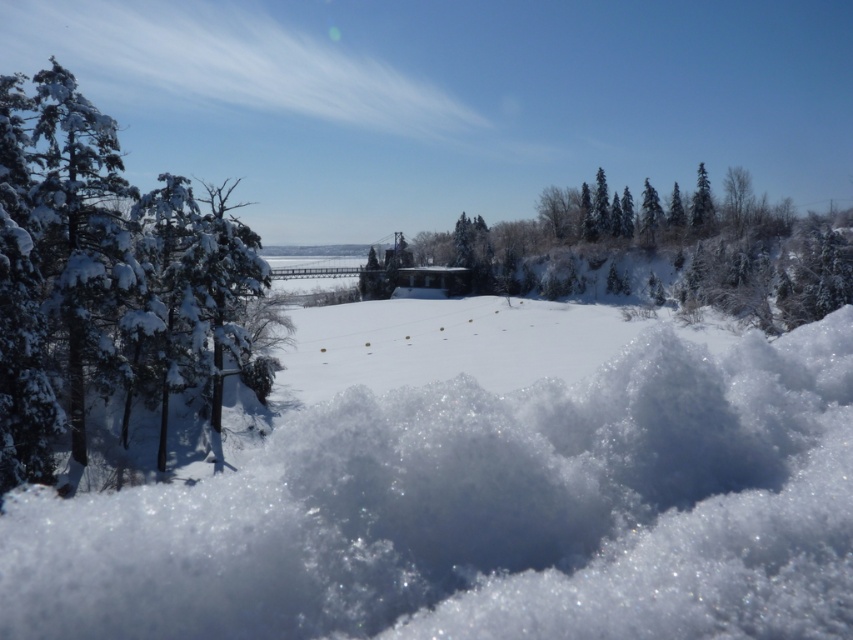
Question: Is snow-covered evergreen at left positioned behind green matte evergreen tree at upper right?

Choices:
 (A) no
 (B) yes

Answer: (A)

Question: Which of these objects is positioned closest to the green matte evergreen tree at upper right?

Choices:
 (A) snow-covered evergreen at left
 (B) green snow-covered trees at center
 (C) white fluffy snow at center

Answer: (B)

Question: Is green snow-covered trees at center positioned at the back of green matte evergreen tree at upper right?

Choices:
 (A) no
 (B) yes

Answer: (A)

Question: Among these objects, which one is nearest to the camera?

Choices:
 (A) green matte evergreen tree at upper right
 (B) green snow-covered trees at center
 (C) snow-covered evergreen at left
 (D) white fluffy snow at center

Answer: (D)

Question: Does white fluffy snow at center have a smaller size compared to snow-covered evergreen at left?

Choices:
 (A) no
 (B) yes

Answer: (B)

Question: Based on their relative distances, which object is farther from the white fluffy snow at center?

Choices:
 (A) green matte evergreen tree at upper right
 (B) snow-covered evergreen at left
 (C) green snow-covered trees at center

Answer: (A)